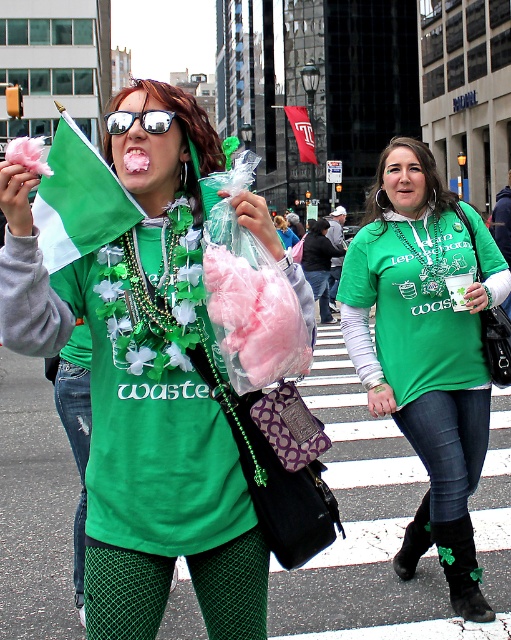
Question: Which object appears closest to the camera in this image?

Choices:
 (A) green matte shirt at center
 (B) red fabric flag at center
 (C) green fabric boot at lower center
 (D) black suede boot at lower right

Answer: (C)

Question: Does reflective plastic sunglasses at upper center appear under red fabric flag at center?

Choices:
 (A) no
 (B) yes

Answer: (B)

Question: Which of the following is the closest to the observer?

Choices:
 (A) (417, 337)
 (B) (428, 516)
 (C) (114, 196)

Answer: (C)

Question: Which point appears farthest from the camera in this image?

Choices:
 (A) (148, 131)
 (B) (415, 550)

Answer: (B)

Question: From the image, what is the correct spatial relationship of green fabric boot at lower center in relation to red fabric flag at center?

Choices:
 (A) below
 (B) above

Answer: (A)

Question: Does green fabric boot at lower center have a greater width compared to red fabric flag at center?

Choices:
 (A) yes
 (B) no

Answer: (B)